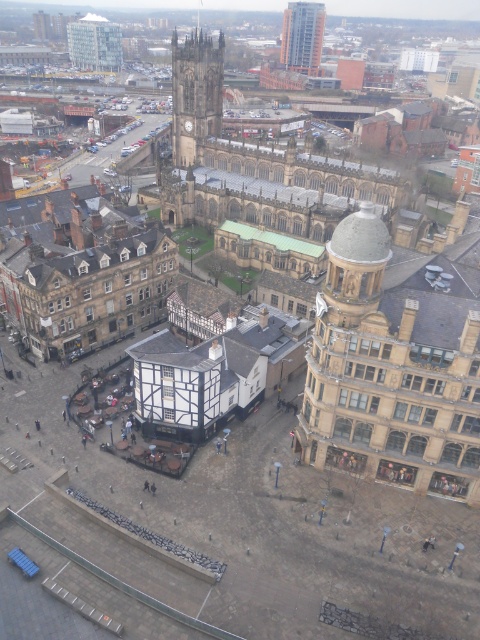
Image resolution: width=480 pixels, height=640 pixels. What do you see at coordinates (195, 93) in the screenshot? I see `dark gray stone clock tower at center` at bounding box center [195, 93].

Who is taller, dark gray stone clock tower at center or glassy steel skyscraper at upper center?

glassy steel skyscraper at upper center is taller.

The height and width of the screenshot is (640, 480). Find the location of `dark gray stone clock tower at center`. dark gray stone clock tower at center is located at coordinates (195, 93).

Where is `beige stone tower at center right`? beige stone tower at center right is located at coordinates (391, 371).

Does beige stone tower at center right have a lesser height compared to white glass tower at upper left?

In fact, beige stone tower at center right may be taller than white glass tower at upper left.

This screenshot has height=640, width=480. I want to click on beige stone tower at center right, so click(x=391, y=371).

Which is more to the right, dark gray stone clock tower at center or white glass tower at upper left?

From the viewer's perspective, dark gray stone clock tower at center appears more on the right side.

Who is positioned more to the left, dark gray stone clock tower at center or white glass tower at upper left?

white glass tower at upper left

Locate an element on the screen. This screenshot has width=480, height=640. dark gray stone clock tower at center is located at coordinates (195, 93).